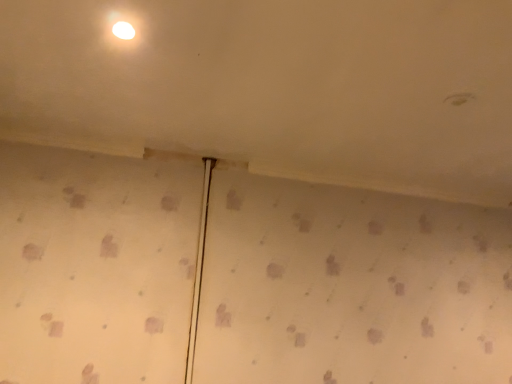
Measure the distance between point (116,35) and camera.

Point (116,35) and camera are 1.10 meters apart from each other.

The height and width of the screenshot is (384, 512). Describe the element at coordinates (123, 30) in the screenshot. I see `white glossy light fixture at upper center` at that location.

This screenshot has height=384, width=512. I want to click on white glossy light fixture at upper center, so click(x=123, y=30).

What is the approximate height of white glossy light fixture at upper center?

1.37 centimeters.

I want to click on white glossy light fixture at upper center, so click(123, 30).